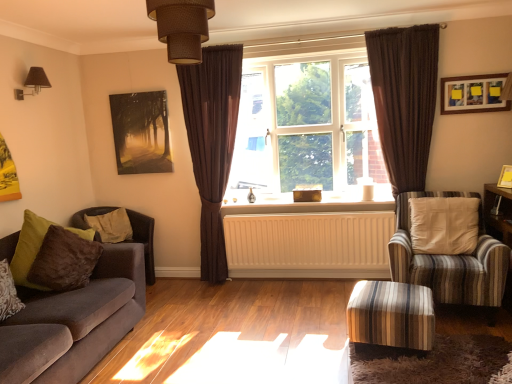
Question: Does point (117, 210) appear closer or farther from the camera than point (502, 168)?

Choices:
 (A) closer
 (B) farther

Answer: (B)

Question: In terms of width, does brown plush pillow at left, marked as the 2th pillow in a front-to-back arrangement, look wider or thinner when compared to wooden picture frame at upper right, the third picture frame when ordered from left to right?

Choices:
 (A) wide
 (B) thin

Answer: (A)

Question: Considering the real-world distances, which object is closest to the brown textured curtain at right, placed as the second curtain when sorted from left to right?

Choices:
 (A) velvet sofa at left
 (B) brown fabric lampshade at upper left, acting as the first light fixture starting from the left
 (C) velvet brown armchair at left, the 1th chair from the back
 (D) clear glass window at center
 (E) wooden framed picture at upper right, the second picture frame positioned from the back

Answer: (E)

Question: Which is farther from the velvet brown pillow at lower left, the first pillow positioned from the front?

Choices:
 (A) matte black painting at upper left, which is the 1th picture frame in back-to-front order
 (B) white painted wood at center
 (C) brown sheer curtain at center, which appears as the 1th curtain when viewed from the left
 (D) brown fabric lampshade at upper left, which appears as the 2th light fixture when viewed from the front
 (E) wooden picture frame at upper right, the first picture frame positioned from the right

Answer: (E)